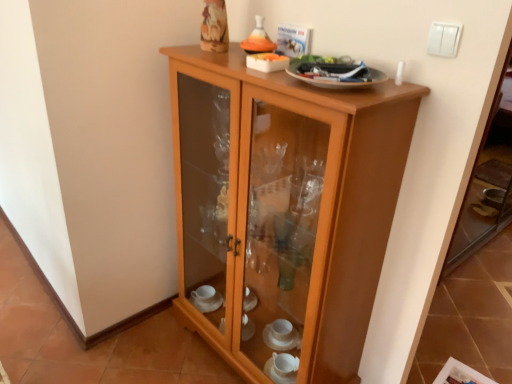
Question: From the image's perspective, is white plastic light switch at upper right located beneath light brown wood cupboard at center?

Choices:
 (A) no
 (B) yes

Answer: (A)

Question: Does white plastic light switch at upper right lie behind light brown wood cupboard at center?

Choices:
 (A) yes
 (B) no

Answer: (A)

Question: Does white plastic light switch at upper right turn towards light brown wood cupboard at center?

Choices:
 (A) yes
 (B) no

Answer: (B)

Question: From the image's perspective, does white plastic light switch at upper right appear higher than light brown wood cupboard at center?

Choices:
 (A) yes
 (B) no

Answer: (A)

Question: Is white plastic light switch at upper right outside light brown wood cupboard at center?

Choices:
 (A) yes
 (B) no

Answer: (A)

Question: Does white plastic light switch at upper right appear on the left side of light brown wood cupboard at center?

Choices:
 (A) yes
 (B) no

Answer: (B)

Question: Is white plastic light switch at upper right inside light brown wood cupboard at center?

Choices:
 (A) yes
 (B) no

Answer: (B)

Question: Would you say light brown wood cupboard at center is a long distance from white plastic light switch at upper right?

Choices:
 (A) yes
 (B) no

Answer: (B)

Question: Is light brown wood cupboard at center further to camera compared to white plastic light switch at upper right?

Choices:
 (A) yes
 (B) no

Answer: (B)

Question: Does light brown wood cupboard at center appear on the right side of white plastic light switch at upper right?

Choices:
 (A) yes
 (B) no

Answer: (B)

Question: Can you confirm if light brown wood cupboard at center is bigger than white plastic light switch at upper right?

Choices:
 (A) no
 (B) yes

Answer: (B)

Question: Is light brown wood cupboard at center not inside white plastic light switch at upper right?

Choices:
 (A) yes
 (B) no

Answer: (A)

Question: Considering the positions of white plastic light switch at upper right and light brown wood cupboard at center in the image, is white plastic light switch at upper right taller or shorter than light brown wood cupboard at center?

Choices:
 (A) short
 (B) tall

Answer: (A)